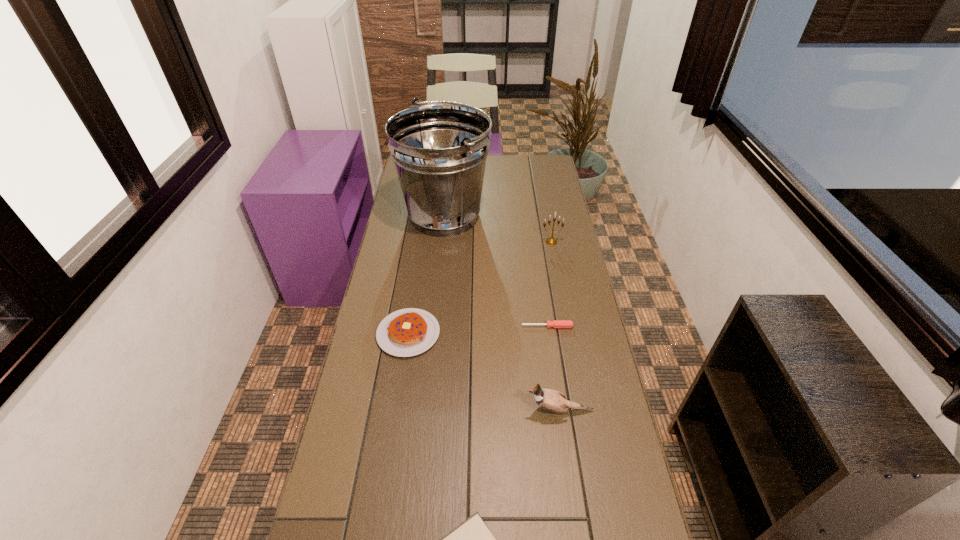
Locate an element on the screen. This screenshot has width=960, height=540. vacant space positioned on the back of the pancake is located at coordinates click(x=420, y=263).

Locate an element on the screen. free location located 0.050m on the right of the screwdriver is located at coordinates (588, 327).

Identify the location of bucket that is at the left edge. (439, 150).

The image size is (960, 540). Find the location of `pancake located at the left edge`. pancake located at the left edge is located at coordinates (407, 332).

Identify the location of candelabrum that is at the right edge. click(x=551, y=241).

Find the location of a particular element. This screenshot has width=960, height=540. bird that is at the right edge is located at coordinates (551, 400).

This screenshot has width=960, height=540. I want to click on screwdriver that is at the right edge, so click(x=555, y=323).

Find the location of a particular element. free region at the far edge of the desktop is located at coordinates (488, 172).

In the image, there is a desktop. Find the location of `vacant space at the left edge`. vacant space at the left edge is located at coordinates (425, 248).

The height and width of the screenshot is (540, 960). I want to click on blank space at the right edge of the desktop, so click(x=569, y=233).